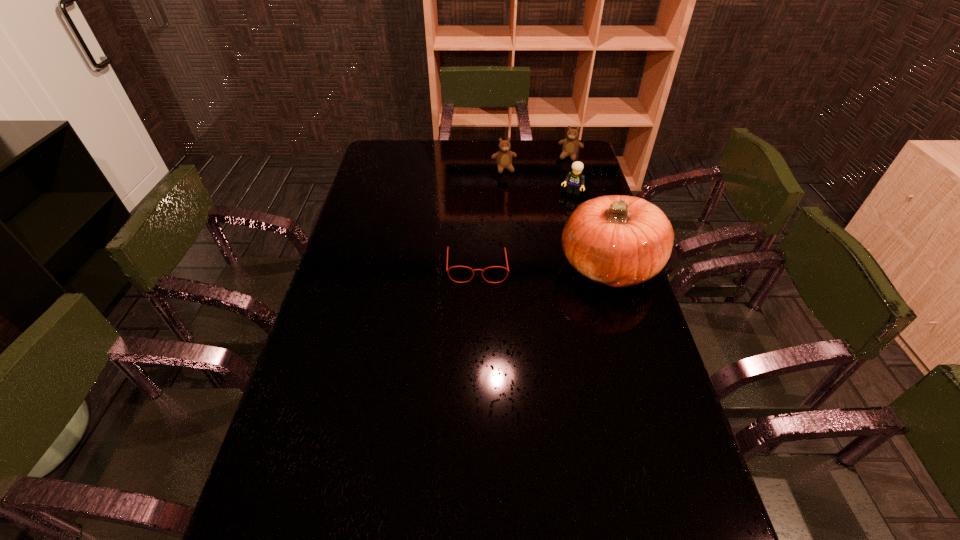
What are the coordinates of `vacant space located at the face of the fourth nearest object` in the screenshot? It's located at (515, 196).

Find the location of a particular element. The width and height of the screenshot is (960, 540). vacant region located 0.380m at the face of the fourth nearest object is located at coordinates point(529,234).

Where is `free space located 0.240m at the face of the right teddy bear`? The height and width of the screenshot is (540, 960). free space located 0.240m at the face of the right teddy bear is located at coordinates (557, 194).

Where is `vacant space located 0.320m at the face of the right teddy bear`? The height and width of the screenshot is (540, 960). vacant space located 0.320m at the face of the right teddy bear is located at coordinates (552, 205).

The image size is (960, 540). In order to click on vacant region located 0.050m at the face of the right teddy bear in this screenshot , I will do `click(565, 168)`.

Locate an element on the screen. free space located 0.220m on the front-facing side of the third nearest object is located at coordinates (554, 231).

At what (x,y) coordinates should I click in order to perform the action: click on vacant space situated on the front-facing side of the third nearest object. Please return your answer as a coordinate pair (x, y). Looking at the image, I should click on (539, 262).

This screenshot has height=540, width=960. Find the location of `free spot located 0.100m on the front-facing side of the third nearest object`. free spot located 0.100m on the front-facing side of the third nearest object is located at coordinates (564, 212).

You are a GUI agent. You are given a task and a screenshot of the screen. Output one action in this format:
    pyautogui.click(x=<x>, y=<y>)
    Task: Click on the pumpkin at the right edge
    
    Given the screenshot: What is the action you would take?
    pyautogui.click(x=616, y=240)

At what (x,y) coordinates should I click in order to perform the action: click on teddy bear that is at the right edge. Please return your answer as a coordinate pair (x, y). Looking at the image, I should click on (570, 147).